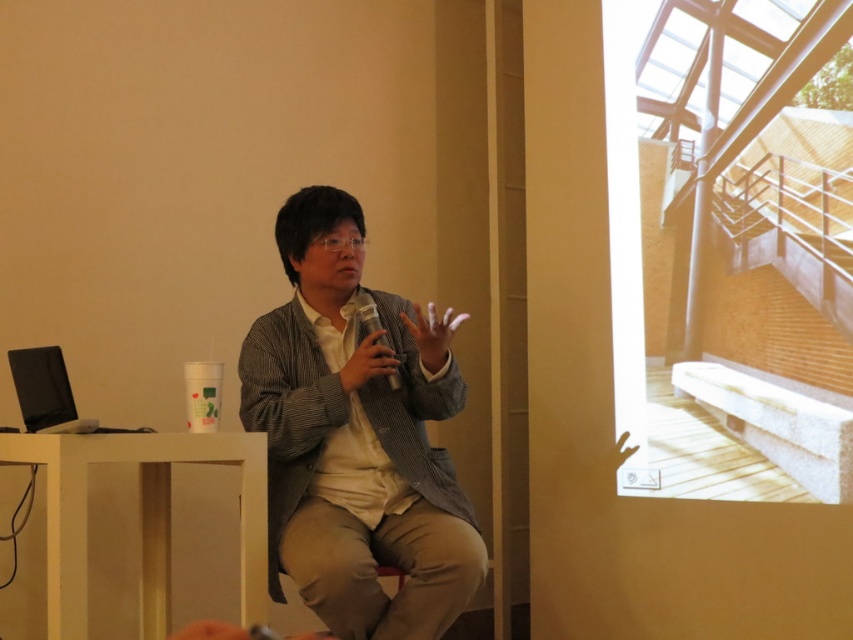
Question: Which object appears closest to the camera in this image?

Choices:
 (A) gray textured blazer at center
 (B) metallic silver cup at center
 (C) matte gray hand at center

Answer: (A)

Question: Which object is the closest to the metallic silver cup at center?

Choices:
 (A) gray textured blazer at center
 (B) matte gray hand at center

Answer: (B)

Question: Is the position of gray textured blazer at center less distant than that of matte gray hand at center?

Choices:
 (A) no
 (B) yes

Answer: (B)

Question: Which point is closer to the camera taking this photo?

Choices:
 (A) (392, 365)
 (B) (294, 262)
 (C) (425, 355)

Answer: (C)

Question: Is matte gray hand at center bigger than metallic silver cup at center?

Choices:
 (A) yes
 (B) no

Answer: (A)

Question: Where is gray textured blazer at center located in relation to matte gray hand at center in the image?

Choices:
 (A) above
 (B) below

Answer: (B)